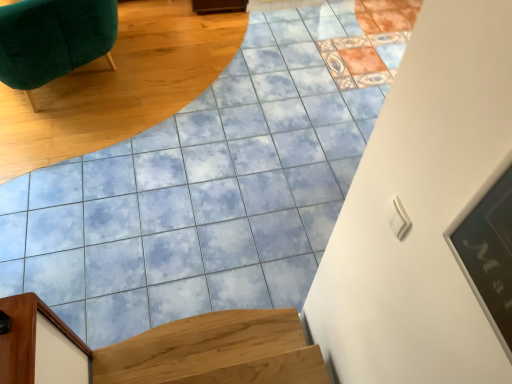
The image size is (512, 384). I want to click on free spot to the right of velvet green chair at upper left, the first furniture when ordered from top to bottom, so coord(156,109).